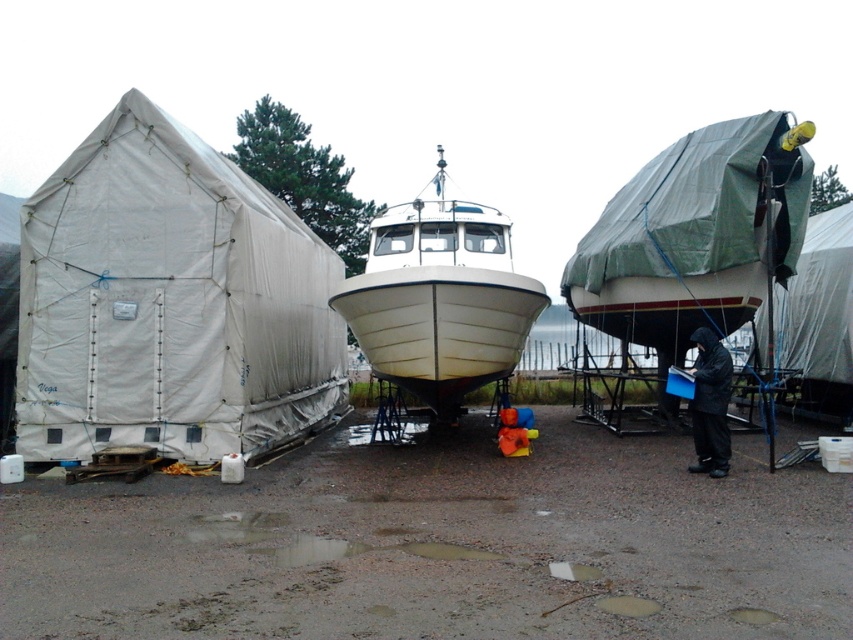
You are a maintenance worker in the boatyard. You need to retrieve a tool from the black matte jacket at lower right. Can you reach it without moving the green tarpaulin tent at center?

The green tarpaulin tent at center is above the black matte jacket at lower right, so you would need to move the green tarpaulin tent at center to access the jacket.

You are a maintenance worker in the boatyard. You need to place a new tool box between the white fabric tent at left and the black matte jacket at lower right. Considering their heights, which object will the tool box be closer to?

The white fabric tent at left has a greater height compared to the black matte jacket at lower right. Therefore, the tool box will be closer to the black matte jacket at lower right since it is shorter.

You are standing at the center of the boatyard and see the white fabric tent at left and the black matte jacket at lower right. Which object is located to the left of the other?

The white fabric tent at left is positioned on the left side of black matte jacket at lower right.